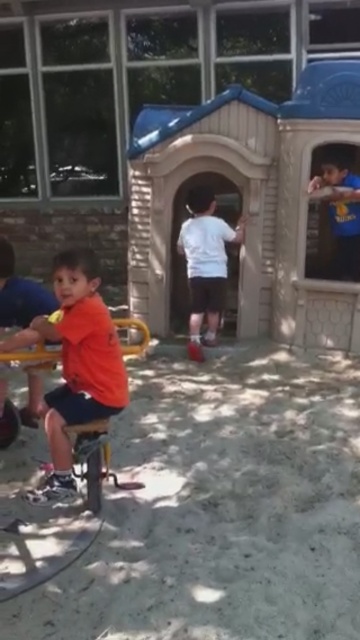
You are standing at the point marked by the coordinates point (x=205, y=264) in the image. Looking around, you see the white matte shirt at center. What is the nearest object to your current position?

The nearest object to the point (x=205, y=264) is the white matte shirt at center, as the point is marked to indicate its location.

You are a parent standing at the edge of the sandbox and see the orange matte shirt at left and the blue matte shirt at upper right. You want to call out to both children to gather near you. Which child is closer to you so you can hear your call more clearly?

The orange matte shirt at left is closer to you than the blue matte shirt at upper right, so they will hear your call more clearly.